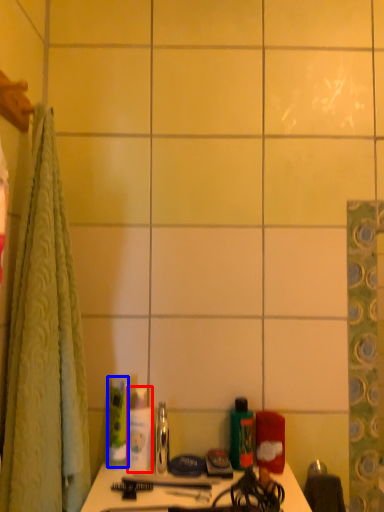
Question: Which object appears closest to the camera in this image, toiletry (highlighted by a red box) or toiletry (highlighted by a blue box)?

Choices:
 (A) toiletry
 (B) toiletry

Answer: (A)